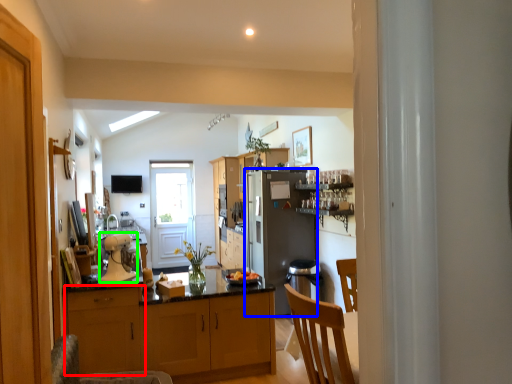
Question: Based on their relative distances, which object is nearer to cabinetry (highlighted by a red box)? Choose from refrigerator (highlighted by a blue box) and kitchen appliance (highlighted by a green box).

Choices:
 (A) refrigerator
 (B) kitchen appliance

Answer: (B)